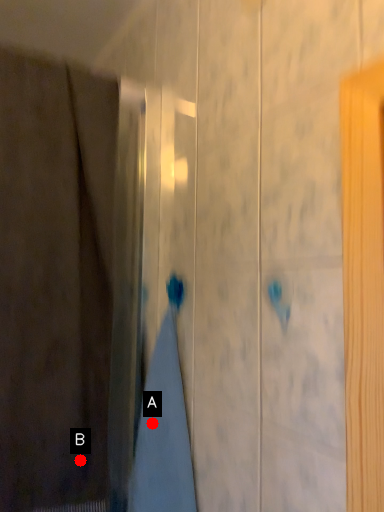
Question: Two points are circled on the image, labeled by A and B beside each circle. Which of the following is the farthest from the observer?

Choices:
 (A) A is further
 (B) B is further

Answer: (B)